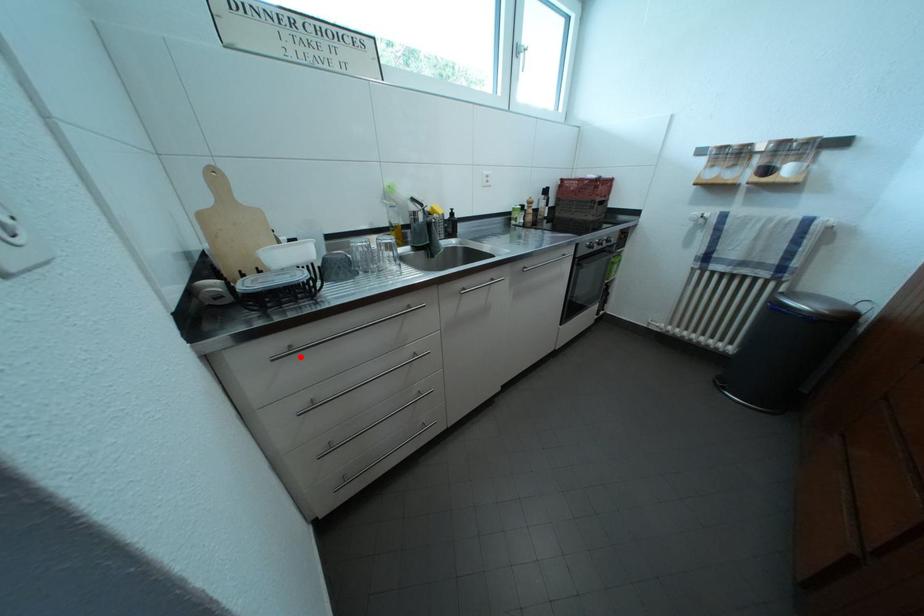
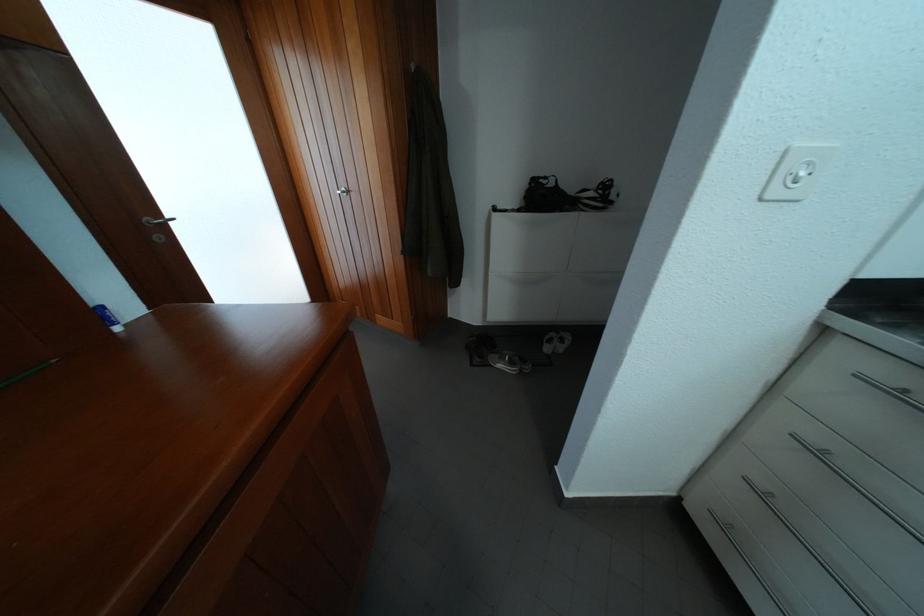
Locate, in the second image, the point that corresponds to the highlighted location in the first image.

(906, 400)